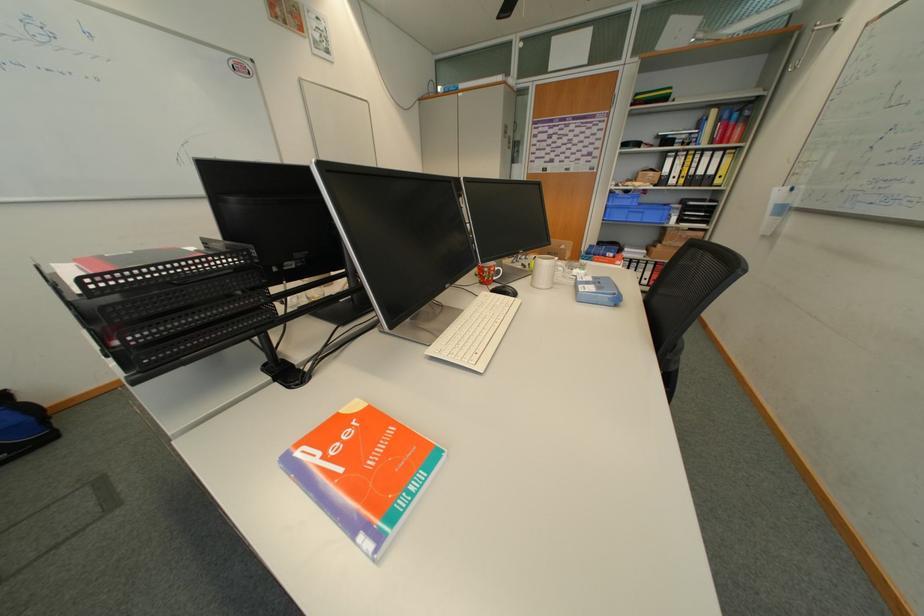
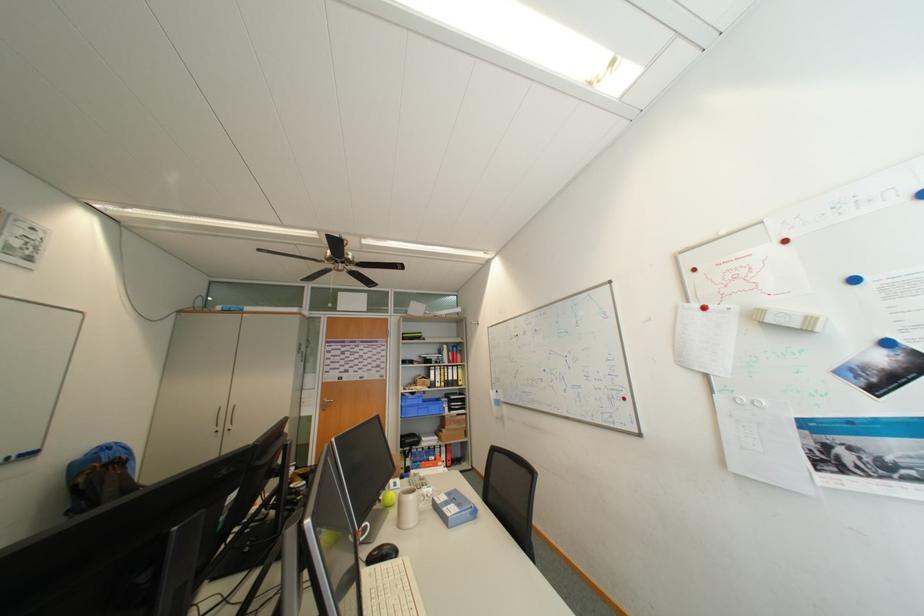
Where in the second image is the point corresponding to (x=637, y=204) from the first image?

(426, 403)